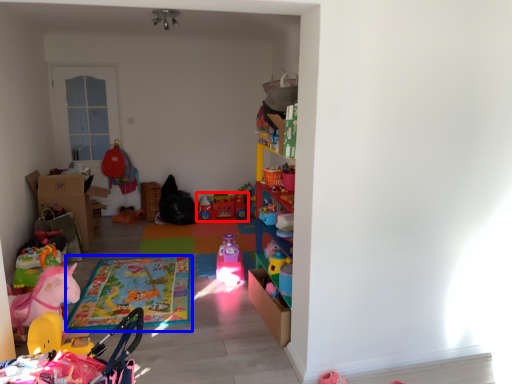
Question: Which point is further to the camera, toy (highlighted by a red box) or mat (highlighted by a blue box)?

Choices:
 (A) toy
 (B) mat

Answer: (A)